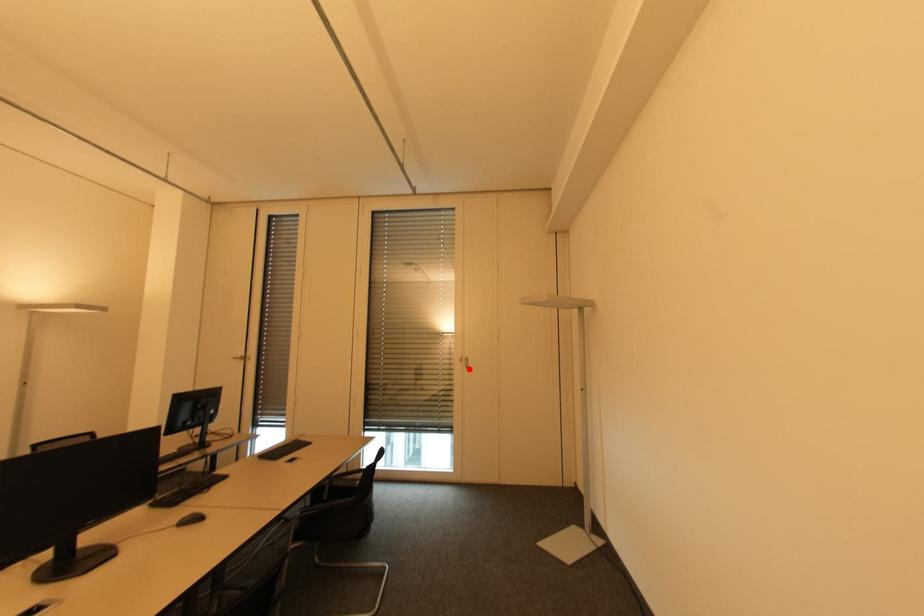
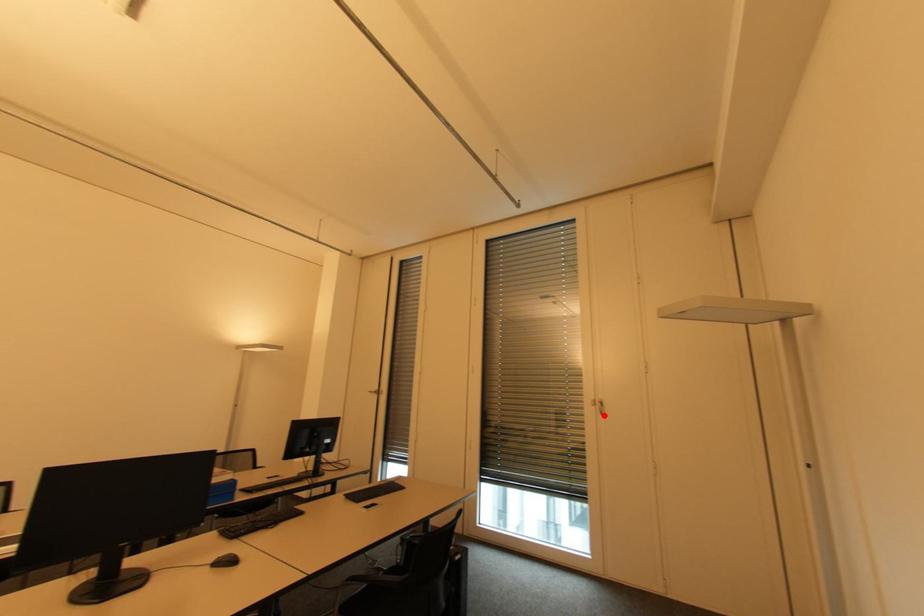
I am providing you with two images of the same scene from different viewpoints. A red point is marked on the first image and another point is marked on the second image. Is the marked point in image1 the same physical position as the marked point in image2?

Yes